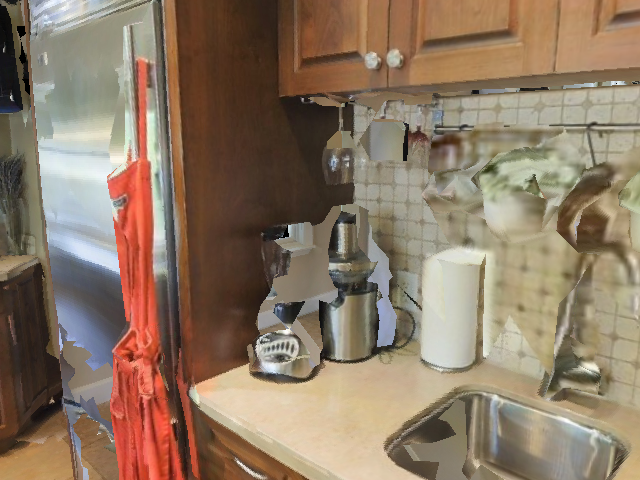
Where is `wine glasses`? This screenshot has width=640, height=480. wine glasses is located at coordinates (337, 171), (420, 154).